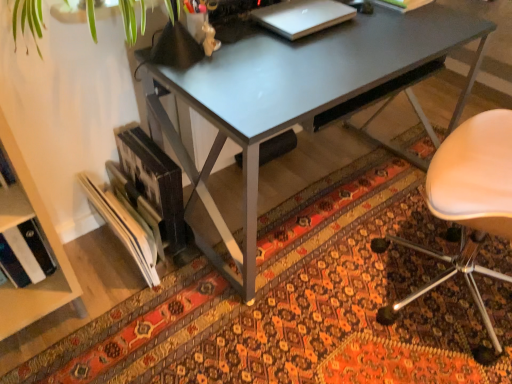
You are a GUI agent. You are given a task and a screenshot of the screen. Output one action in this format:
    pyautogui.click(x=<x>, y=<y>)
    Task: Click on the free space above sleek silver laptop at upper center (from a real-world perspective)
    The width and height of the screenshot is (512, 384).
    Given the screenshot: What is the action you would take?
    pyautogui.click(x=305, y=11)